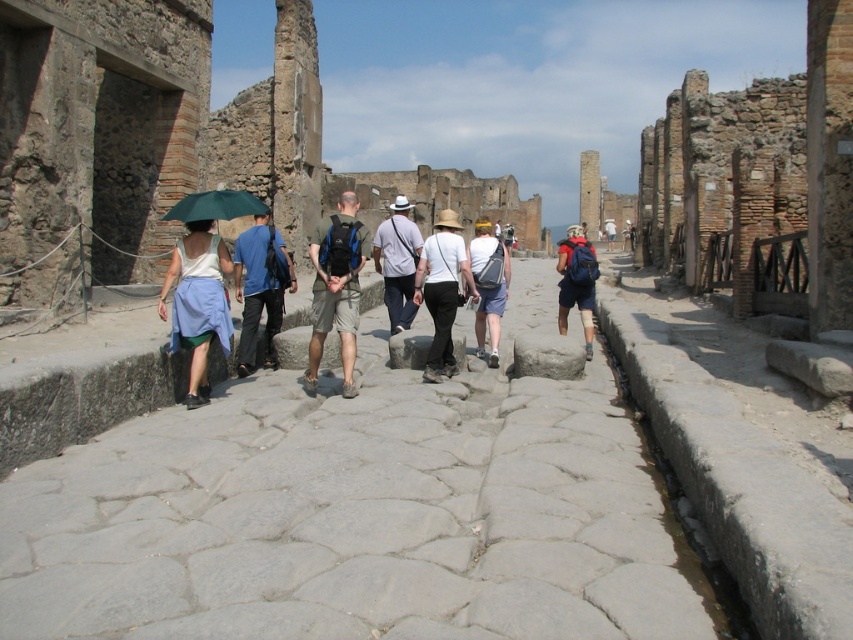
You are a photographer standing at the back of the group. You want to take a photo of both the blue denim jeans at center and the denim shorts at center. Which one should you adjust your position to focus on first to ensure both are in the frame?

You should focus on the blue denim jeans at center first because it is in front of the denim shorts at center, so adjusting your position to include the blue denim jeans at center will naturally include the denim shorts at center behind it.

You are a photographer positioned at the center of the archaeological site. You want to take a photo that includes both the blue denim jeans at center and the white fabric hat at center. Which object should you adjust to ensure both are in focus?

To ensure both the blue denim jeans at center and the white fabric hat at center are in focus, you should adjust the blue denim jeans at center because it is in front of the white fabric hat at center, so moving it closer or farther might help achieve the desired focus.

You are a photographer standing at the center of an ancient archaeological site. You notice a green fabric backpack at center and a white fabric hat at center. Which item is closer to your camera lens?

The green fabric backpack at center is positioned over the white fabric hat at center, meaning it is closer to the camera lens.